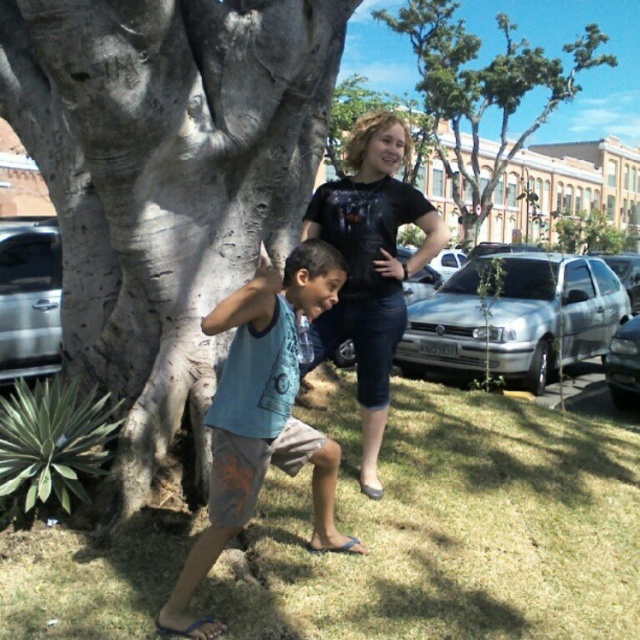
Question: Which point is closer to the camera taking this photo?

Choices:
 (A) (278, 240)
 (B) (150, 556)

Answer: (B)

Question: Among these points, which one is nearest to the camera?

Choices:
 (A) (67, 220)
 (B) (577, 44)
 (C) (378, 301)
 (D) (627, 522)

Answer: (C)

Question: Is green grass at lower center wider than blue cotton tank top at center?

Choices:
 (A) no
 (B) yes

Answer: (B)

Question: Which of the following is the closest to the observer?

Choices:
 (A) (273, 544)
 (B) (488, 86)
 (C) (244, 492)
 (D) (150, 108)

Answer: (C)

Question: Does gray rough bark tree at center appear under blue cotton tank top at center?

Choices:
 (A) yes
 (B) no

Answer: (B)

Question: Is black t-shirt at center below green leafy tree at upper center?

Choices:
 (A) yes
 (B) no

Answer: (A)